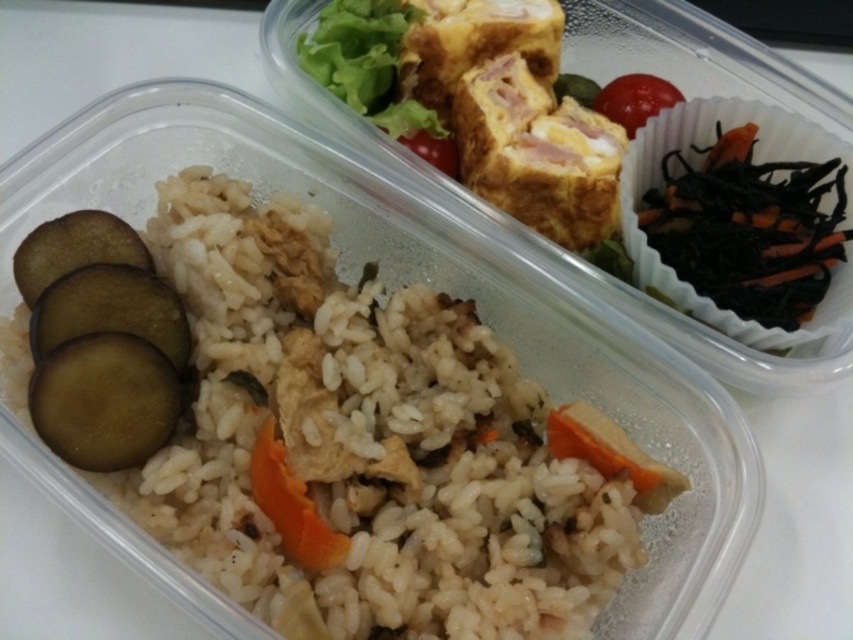
Who is more distant from viewer, (688, 182) or (254, 464)?

The point (688, 182) is behind.

Does black shredded seaweed at upper right appear on the right side of orange matte carrot at center?

Yes, black shredded seaweed at upper right is to the right of orange matte carrot at center.

Between point (659, 188) and point (288, 545), which one is positioned in front?

Positioned in front is point (288, 545).

Image resolution: width=853 pixels, height=640 pixels. Find the location of `black shredded seaweed at upper right`. black shredded seaweed at upper right is located at coordinates (x=747, y=228).

Does black shredded seaweed at upper right have a larger size compared to red matte tomato at upper right?

Indeed, black shredded seaweed at upper right has a larger size compared to red matte tomato at upper right.

From the picture: Does black shredded seaweed at upper right lie behind red matte tomato at upper right?

No, it is in front of red matte tomato at upper right.

You are a GUI agent. You are given a task and a screenshot of the screen. Output one action in this format:
    pyautogui.click(x=<x>, y=<y>)
    Task: Click on the black shredded seaweed at upper right
    The width and height of the screenshot is (853, 640).
    Given the screenshot: What is the action you would take?
    pyautogui.click(x=747, y=228)

From the picture: Who is more forward, (483, 380) or (308, 515)?

Point (308, 515) is in front.

Can you confirm if white matte rice at center is smaller than orange matte carrot at center?

No, white matte rice at center is not smaller than orange matte carrot at center.

Identify the location of white matte rice at center. The image size is (853, 640). (364, 442).